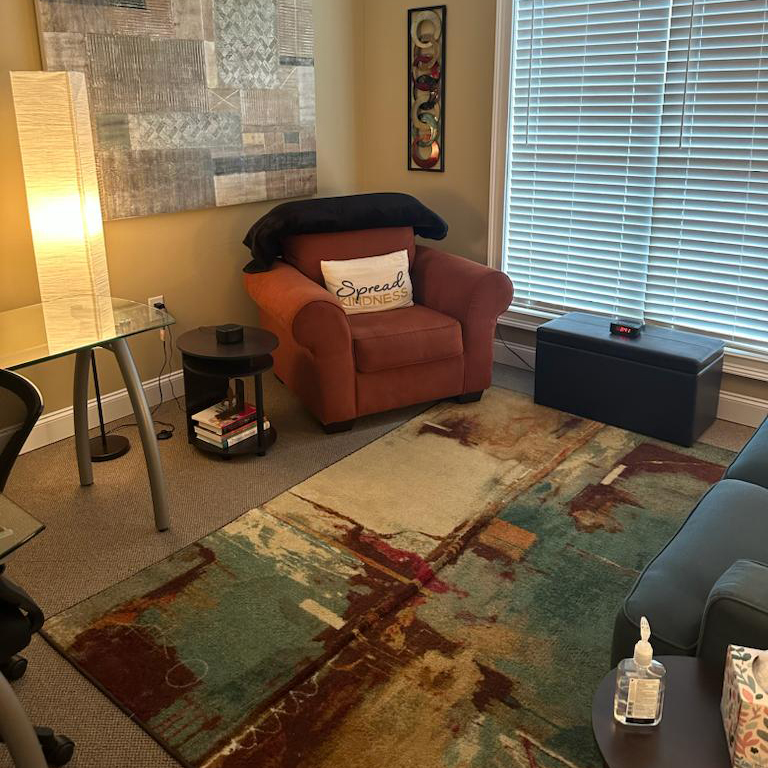
Where is `blinds`? blinds is located at coordinates (614, 189).